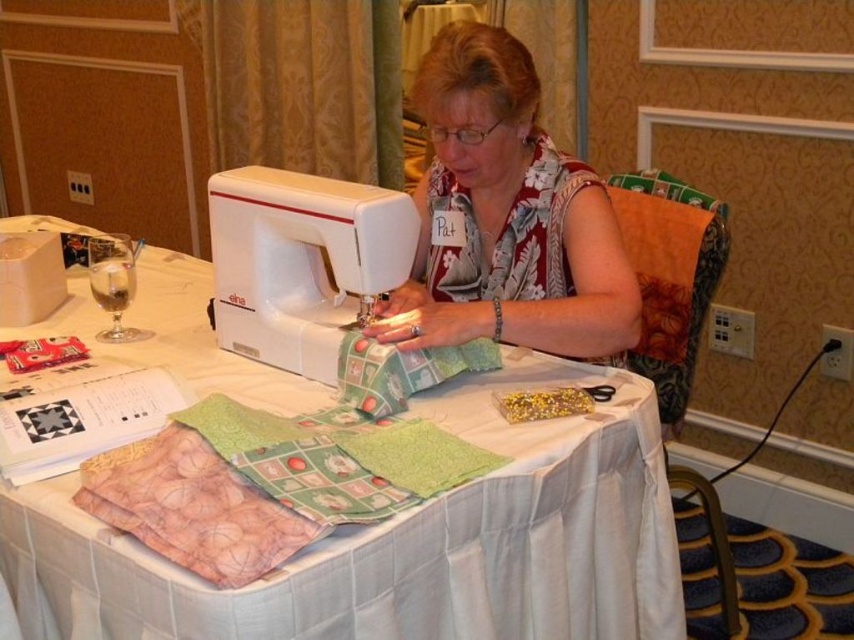
Question: Which is farther from the white cloth table at center?

Choices:
 (A) white floral blouse at center
 (B) white plastic sewing machine at center

Answer: (A)

Question: Can you confirm if white floral blouse at center is bigger than white plastic sewing machine at center?

Choices:
 (A) no
 (B) yes

Answer: (B)

Question: Can you confirm if white cloth table at center is bigger than white floral blouse at center?

Choices:
 (A) no
 (B) yes

Answer: (B)

Question: Can you confirm if white cloth table at center is wider than white floral blouse at center?

Choices:
 (A) yes
 (B) no

Answer: (A)

Question: Which point is farther to the camera?

Choices:
 (A) white floral blouse at center
 (B) white cloth table at center

Answer: (A)

Question: Which object is farther from the camera taking this photo?

Choices:
 (A) white plastic sewing machine at center
 (B) white cloth table at center
 (C) white floral blouse at center

Answer: (C)